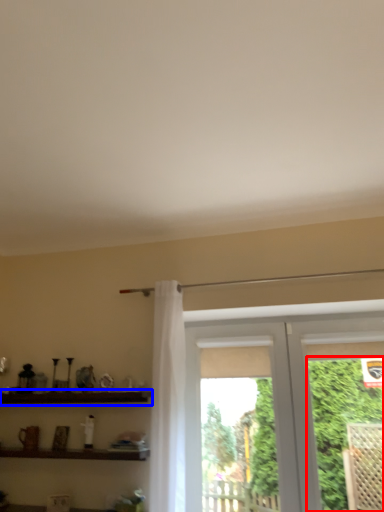
Question: Which object appears farthest to the camera in this image, plant (highlighted by a red box) or shelf (highlighted by a blue box)?

Choices:
 (A) plant
 (B) shelf

Answer: (B)